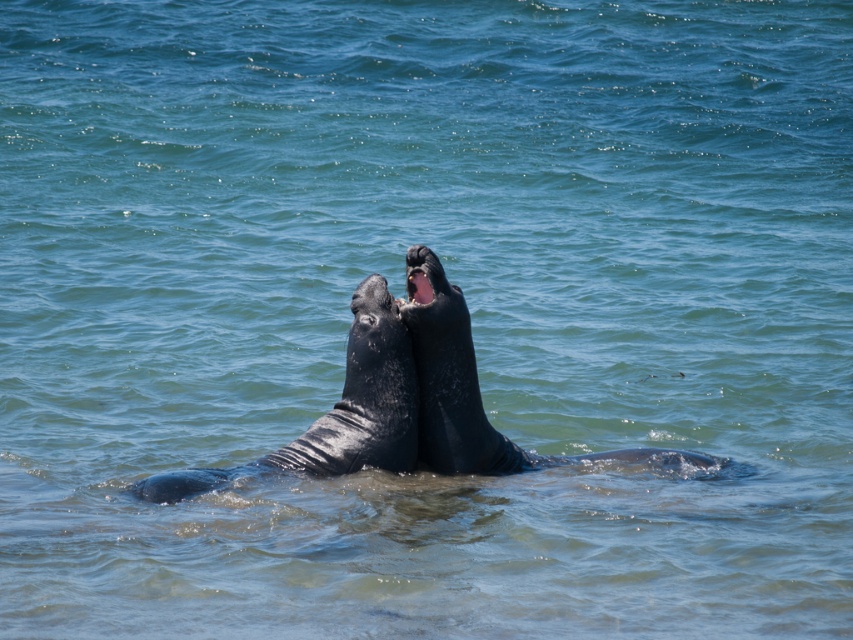
You are a marine biologist observing two whales in the water. You notice a shiny black whale at center and a smooth dark gray whale at center. Which whale is positioned to the left?

The shiny black whale at center is positioned to the left of the smooth dark gray whale at center.

You are observing two elephant seals in the water. You notice two points marked in the scene. The first point is at coordinates point (x=334, y=451), and the second is at point (x=436, y=378). From your perspective, which point is closer to you?

Point (x=334, y=451) is in front of point (x=436, y=378), so it is closer to you.

You are a marine biologist observing two whales in the water. You notice the shiny black whale at center and the smooth dark gray whale at center. Which whale is more slender in shape?

The shiny black whale at center is thinner than smooth dark gray whale at center, so it is more slender in shape.